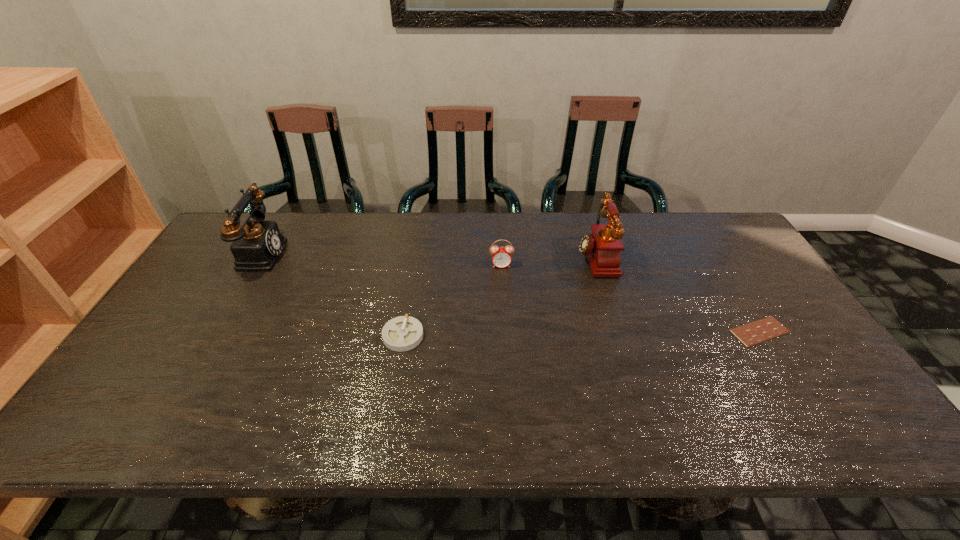
In order to click on free location that satisfies the following two spatial constraints: 1. on the dial of the fourth object from left to right; 2. on the right side of the rightmost object in this screenshot , I will do `click(617, 332)`.

The width and height of the screenshot is (960, 540). In order to click on free space that satisfies the following two spatial constraints: 1. on the front of the leftmost object at the rotary dial; 2. on the left side of the ashtray in this screenshot , I will do `click(210, 336)`.

Identify the location of free space that satisfies the following two spatial constraints: 1. on the front of the left telephone at the rotary dial; 2. on the back side of the fourth tallest object. (210, 336).